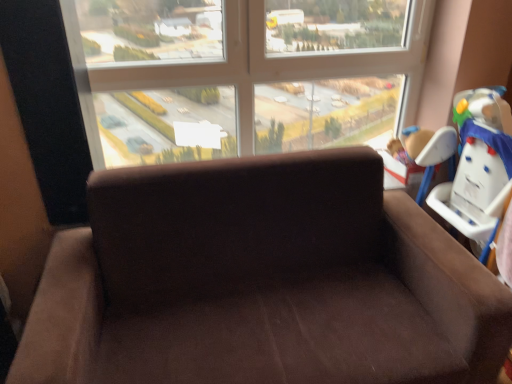
Question: Does transparent glass window at upper center have a lesser width compared to white plastic baby carriage at right?

Choices:
 (A) yes
 (B) no

Answer: (B)

Question: Is transparent glass window at upper center directly adjacent to white plastic baby carriage at right?

Choices:
 (A) yes
 (B) no

Answer: (B)

Question: Is transparent glass window at upper center facing away from white plastic baby carriage at right?

Choices:
 (A) yes
 (B) no

Answer: (B)

Question: Does transparent glass window at upper center turn towards white plastic baby carriage at right?

Choices:
 (A) yes
 (B) no

Answer: (A)

Question: Is transparent glass window at upper center positioned before white plastic baby carriage at right?

Choices:
 (A) no
 (B) yes

Answer: (A)

Question: Considering the positions of point (404, 135) and point (468, 114), is point (404, 135) closer or farther from the camera than point (468, 114)?

Choices:
 (A) farther
 (B) closer

Answer: (A)

Question: From a real-world perspective, is brown plush toy at upper right positioned above or below white plastic baby carriage at right?

Choices:
 (A) above
 (B) below

Answer: (A)

Question: From the image's perspective, is brown plush toy at upper right above or below white plastic baby carriage at right?

Choices:
 (A) below
 (B) above

Answer: (B)

Question: In terms of width, does brown plush toy at upper right look wider or thinner when compared to white plastic baby carriage at right?

Choices:
 (A) wide
 (B) thin

Answer: (B)

Question: Choose the correct answer: Is white plastic baby carriage at right inside brown plush toy at upper right or outside it?

Choices:
 (A) outside
 (B) inside

Answer: (A)

Question: Is white plastic baby carriage at right taller or shorter than brown plush toy at upper right?

Choices:
 (A) short
 (B) tall

Answer: (B)

Question: Would you say white plastic baby carriage at right is to the left or to the right of brown plush toy at upper right in the picture?

Choices:
 (A) right
 (B) left

Answer: (A)

Question: Is white plastic baby carriage at right bigger or smaller than brown plush toy at upper right?

Choices:
 (A) big
 (B) small

Answer: (A)

Question: Does point (65, 14) appear closer or farther from the camera than point (412, 127)?

Choices:
 (A) closer
 (B) farther

Answer: (A)

Question: From the image's perspective, relative to brown plush toy at upper right, is transparent glass window at upper center above or below?

Choices:
 (A) below
 (B) above

Answer: (B)